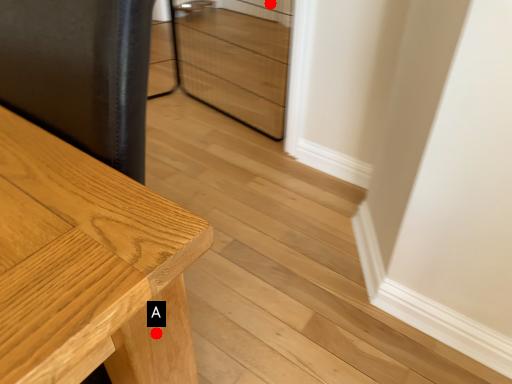
Question: Two points are circled on the image, labeled by A and B beside each circle. Which of the following is the farthest from the observer?

Choices:
 (A) A is further
 (B) B is further

Answer: (B)